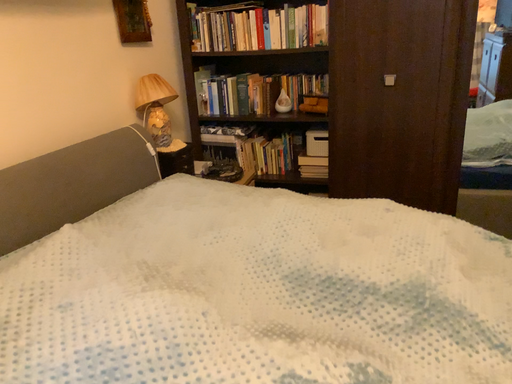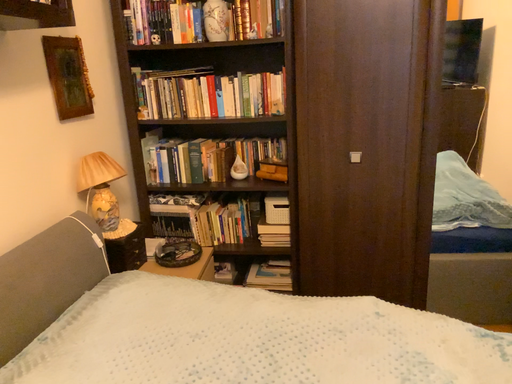
Question: How did the camera likely rotate when shooting the video?

Choices:
 (A) rotated right
 (B) rotated left

Answer: (A)